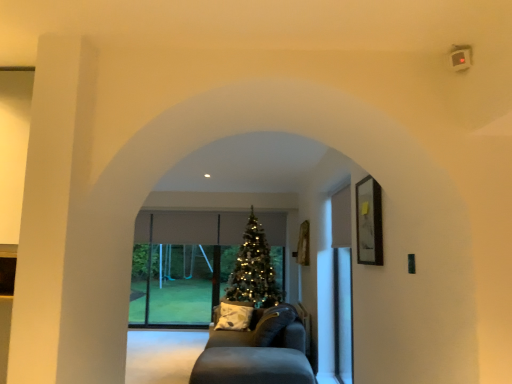
Question: Does transparent glass door at center appear on the left side of shiny gold christmas tree at center?

Choices:
 (A) yes
 (B) no

Answer: (A)

Question: From a real-world perspective, is transparent glass door at center located beneath shiny gold christmas tree at center?

Choices:
 (A) yes
 (B) no

Answer: (A)

Question: Can you confirm if transparent glass door at center is bigger than shiny gold christmas tree at center?

Choices:
 (A) yes
 (B) no

Answer: (B)

Question: Is transparent glass door at center oriented away from shiny gold christmas tree at center?

Choices:
 (A) yes
 (B) no

Answer: (B)

Question: Can you confirm if transparent glass door at center is thinner than shiny gold christmas tree at center?

Choices:
 (A) yes
 (B) no

Answer: (A)

Question: Is transparent glass door at center behind shiny gold christmas tree at center?

Choices:
 (A) no
 (B) yes

Answer: (B)

Question: Is transparent glass screen door at right at the back of dark gray fabric couch at center?

Choices:
 (A) yes
 (B) no

Answer: (B)

Question: Is dark gray fabric couch at center shorter than transparent glass screen door at right?

Choices:
 (A) yes
 (B) no

Answer: (A)

Question: Does dark gray fabric couch at center contain transparent glass screen door at right?

Choices:
 (A) yes
 (B) no

Answer: (B)

Question: Does dark gray fabric couch at center appear on the right side of transparent glass screen door at right?

Choices:
 (A) yes
 (B) no

Answer: (B)

Question: Does dark gray fabric couch at center have a lesser width compared to transparent glass screen door at right?

Choices:
 (A) yes
 (B) no

Answer: (B)

Question: From the image's perspective, is dark gray fabric couch at center below transparent glass screen door at right?

Choices:
 (A) no
 (B) yes

Answer: (B)

Question: Is shiny gold christmas tree at center outside dark gray fabric couch at center?

Choices:
 (A) no
 (B) yes

Answer: (B)